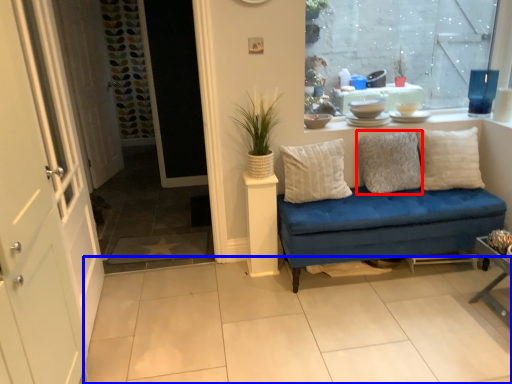
Question: Among these objects, which one is farthest to the camera, pillow (highlighted by a red box) or tile (highlighted by a blue box)?

Choices:
 (A) pillow
 (B) tile

Answer: (A)